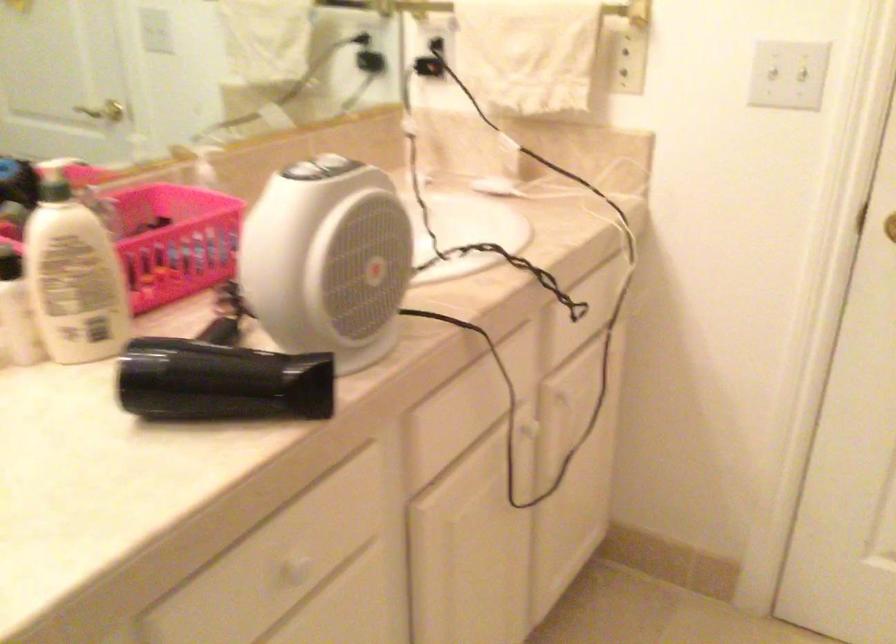
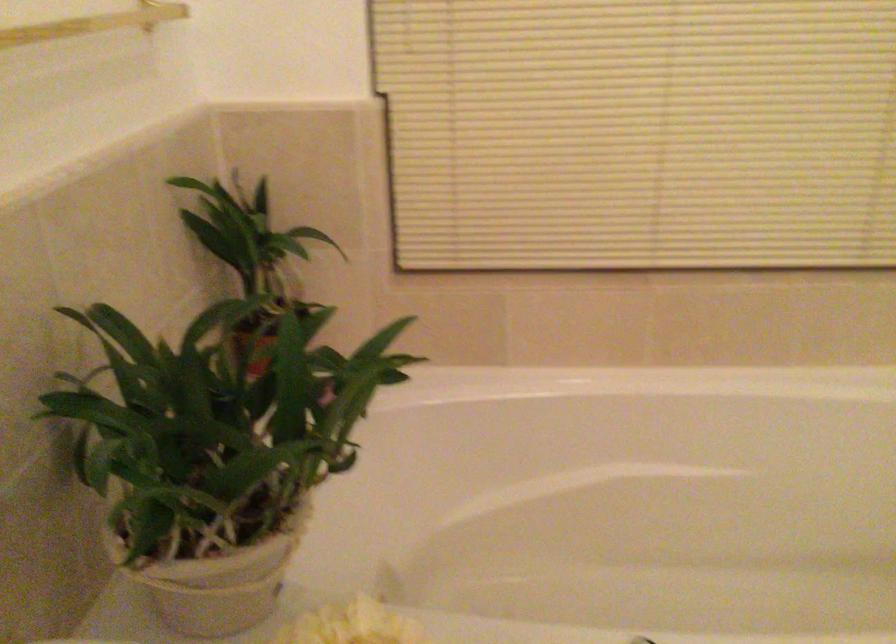
How did the camera likely rotate?

The camera's rotation is toward right-down.